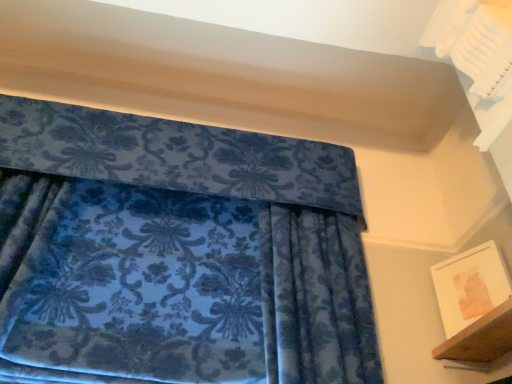
In order to face white matte picture frame at lower right, should I rotate leftwards or rightwards?

Turn right by 26.628 degrees to look at white matte picture frame at lower right.

The image size is (512, 384). Describe the element at coordinates (470, 286) in the screenshot. I see `white matte picture frame at lower right` at that location.

Find the location of `white matte picture frame at lower right`. white matte picture frame at lower right is located at coordinates (470, 286).

Describe the element at coordinates (481, 338) in the screenshot. I see `wooden shelf at lower right` at that location.

What is the approximate width of wooden shelf at lower right?

It is 24.01 centimeters.

At what (x,y) coordinates should I click in order to perform the action: click on wooden shelf at lower right. Please return your answer as a coordinate pair (x, y). Looking at the image, I should click on (481, 338).

The width and height of the screenshot is (512, 384). What are the coordinates of `white matte picture frame at lower right` in the screenshot? It's located at (470, 286).

Which object is positioned more to the left, wooden shelf at lower right or white matte picture frame at lower right?

From the viewer's perspective, wooden shelf at lower right appears more on the left side.

Consider the image. Does wooden shelf at lower right lie behind white matte picture frame at lower right?

No, wooden shelf at lower right is closer to the camera.

Considering the positions of points (487, 316) and (496, 265), is point (487, 316) closer to camera compared to point (496, 265)?

Yes, point (487, 316) is closer to viewer.

From the image's perspective, is wooden shelf at lower right on white matte picture frame at lower right?

No, from the image's perspective, wooden shelf at lower right is not above white matte picture frame at lower right.

In the scene shown: From a real-world perspective, is wooden shelf at lower right physically located above or below white matte picture frame at lower right?

wooden shelf at lower right is situated lower than white matte picture frame at lower right in the real world.

Between wooden shelf at lower right and white matte picture frame at lower right, which one has larger width?

Wider between the two is wooden shelf at lower right.

From their relative heights in the image, would you say wooden shelf at lower right is taller or shorter than white matte picture frame at lower right?

Considering their sizes, wooden shelf at lower right has less height than white matte picture frame at lower right.

Can you confirm if wooden shelf at lower right is smaller than white matte picture frame at lower right?

Actually, wooden shelf at lower right might be larger than white matte picture frame at lower right.

Is wooden shelf at lower right outside of white matte picture frame at lower right?

wooden shelf at lower right lies outside white matte picture frame at lower right's area.

Is wooden shelf at lower right positioned far away from white matte picture frame at lower right?

wooden shelf at lower right is actually quite close to white matte picture frame at lower right.

Could you tell me if wooden shelf at lower right is facing white matte picture frame at lower right?

No, wooden shelf at lower right is not facing towards white matte picture frame at lower right.

Looking at this image, can you tell me how much wooden shelf at lower right and white matte picture frame at lower right differ in facing direction?

They differ by 23.5 degrees in their facing directions.

Find the location of a particular element. This screenshot has width=512, height=384. shelf lying on the left of white matte picture frame at lower right is located at coordinates (481, 338).

Consider the image. In the image, is white matte picture frame at lower right on the left side or the right side of wooden shelf at lower right?

Based on their positions, white matte picture frame at lower right is located to the right of wooden shelf at lower right.

Is white matte picture frame at lower right closer to the viewer compared to wooden shelf at lower right?

No, white matte picture frame at lower right is further to the viewer.

Is point (457, 306) positioned behind point (483, 362)?

That is True.

From the image's perspective, between white matte picture frame at lower right and wooden shelf at lower right, which one is located above?

white matte picture frame at lower right appears higher in the image.

From a real-world perspective, is white matte picture frame at lower right physically below wooden shelf at lower right?

Actually, white matte picture frame at lower right is physically above wooden shelf at lower right in the real world.

Between white matte picture frame at lower right and wooden shelf at lower right, which one has smaller width?

With smaller width is white matte picture frame at lower right.

Is white matte picture frame at lower right taller or shorter than wooden shelf at lower right?

Considering their sizes, white matte picture frame at lower right has more height than wooden shelf at lower right.

In terms of size, does white matte picture frame at lower right appear bigger or smaller than wooden shelf at lower right?

Clearly, white matte picture frame at lower right is smaller in size than wooden shelf at lower right.

Is white matte picture frame at lower right inside or outside of wooden shelf at lower right?

white matte picture frame at lower right cannot be found inside wooden shelf at lower right.

Is white matte picture frame at lower right far from wooden shelf at lower right?

No, white matte picture frame at lower right is in close proximity to wooden shelf at lower right.

Is white matte picture frame at lower right oriented away from wooden shelf at lower right?

No, wooden shelf at lower right is not at the back of white matte picture frame at lower right.

What's the angular difference between white matte picture frame at lower right and wooden shelf at lower right's facing directions?

white matte picture frame at lower right and wooden shelf at lower right are facing 23.5 degrees away from each other.

Measure the distance from white matte picture frame at lower right to wooden shelf at lower right.

A distance of 7.10 inches exists between white matte picture frame at lower right and wooden shelf at lower right.

The width and height of the screenshot is (512, 384). I want to click on picture frame above the wooden shelf at lower right (from the image's perspective), so 470,286.

This screenshot has width=512, height=384. In order to click on shelf in front of the white matte picture frame at lower right in this screenshot , I will do `click(481, 338)`.

This screenshot has height=384, width=512. Identify the location of picture frame above the wooden shelf at lower right (from a real-world perspective). (470, 286).